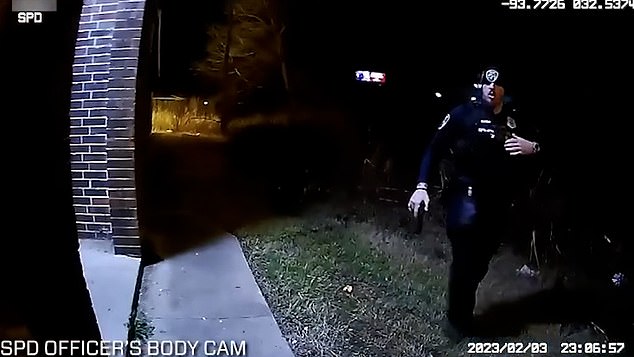
Where is `pillar`? pillar is located at coordinates (94, 61).